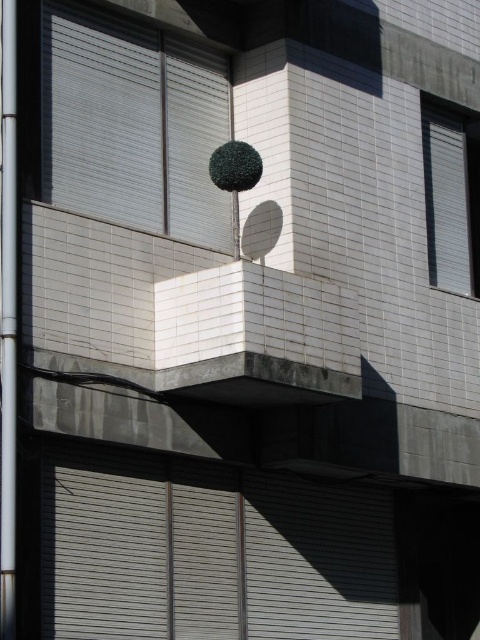
Question: Does matte gray window at upper left lie behind white matte window at upper right?

Choices:
 (A) no
 (B) yes

Answer: (A)

Question: Which of the following is the farthest from the observer?

Choices:
 (A) metallic pole at left
 (B) white matte window at upper right

Answer: (B)

Question: Is matte gray window at upper left below metallic pole at left?

Choices:
 (A) yes
 (B) no

Answer: (B)

Question: Among these objects, which one is farthest from the camera?

Choices:
 (A) matte gray window at upper left
 (B) metallic pole at left

Answer: (A)

Question: Which of the following is the farthest from the observer?

Choices:
 (A) matte gray window at upper left
 (B) metallic pole at left

Answer: (A)

Question: Does metallic pole at left appear on the left side of white matte window at upper right?

Choices:
 (A) yes
 (B) no

Answer: (A)